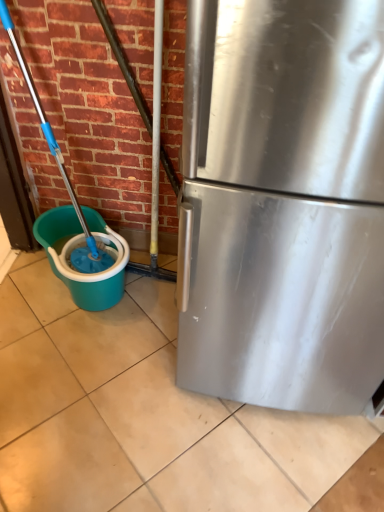
What is the approximate width of teal plastic bucket at lower left?

The width of teal plastic bucket at lower left is 19.76 inches.

Describe the element at coordinates (76, 247) in the screenshot. Image resolution: width=384 pixels, height=512 pixels. I see `teal plastic bucket at lower left` at that location.

Where is `teal plastic bucket at lower left`? This screenshot has width=384, height=512. teal plastic bucket at lower left is located at coordinates (76, 247).

Locate an element on the screen. The image size is (384, 512). teal plastic bucket at lower left is located at coordinates (76, 247).